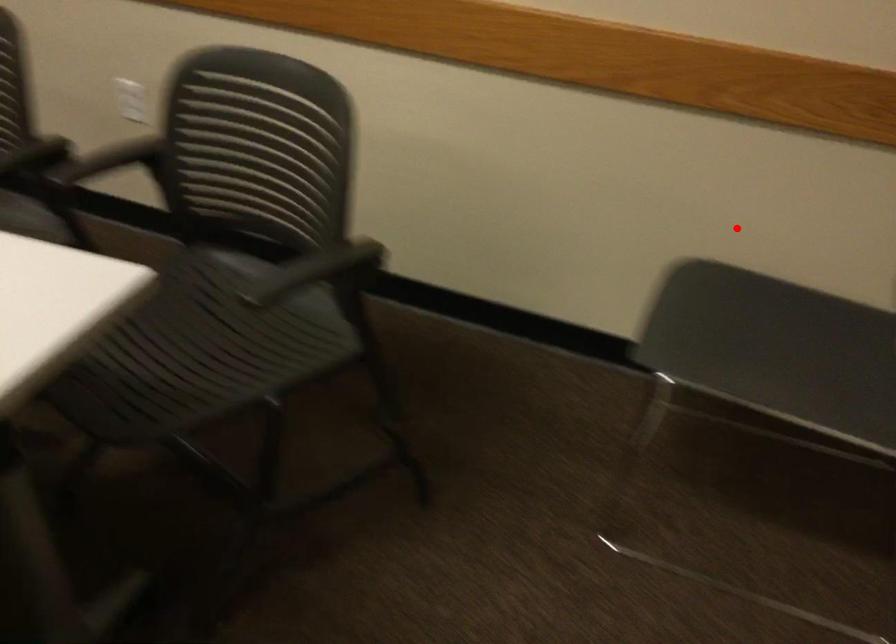
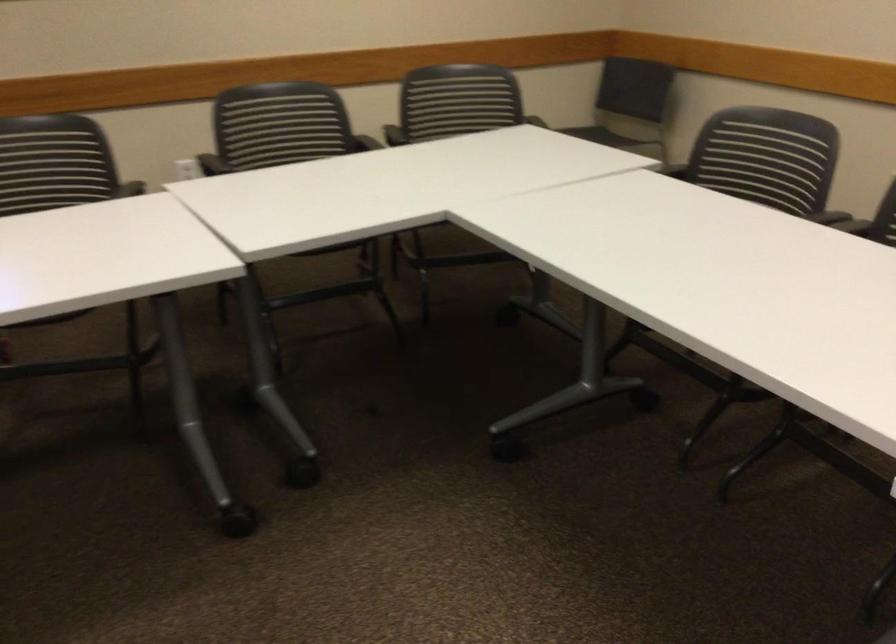
Question: I am providing you with two images of the same scene from different viewpoints. Image1 has a red point marked. In image2, the corresponding 3D location appears at what relative position? Reply with the corresponding letter.

Choices:
 (A) Closer
 (B) Farther

Answer: (B)